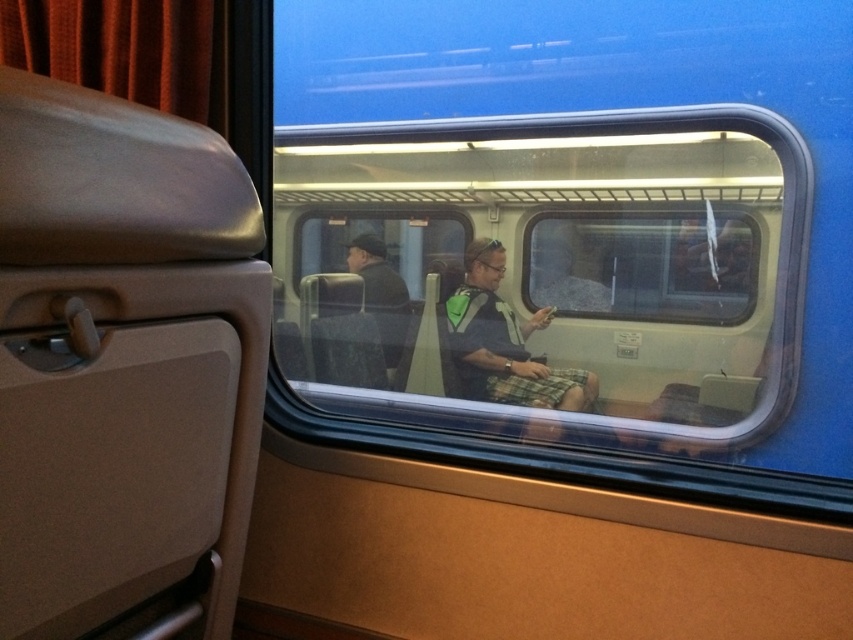
Question: Which point is farther from the camera taking this photo?

Choices:
 (A) (607, 314)
 (B) (584, 400)

Answer: (A)

Question: Which point appears closest to the camera in this image?

Choices:
 (A) (479, 376)
 (B) (349, 230)

Answer: (A)

Question: Is transparent glass train window at center to the right of green fabric backpack at center from the viewer's perspective?

Choices:
 (A) yes
 (B) no

Answer: (B)

Question: In this image, where is transparent glass train window at center located relative to green fabric backpack at center?

Choices:
 (A) above
 (B) below

Answer: (A)

Question: Can you confirm if transparent glass train window at center is bigger than green fabric backpack at center?

Choices:
 (A) yes
 (B) no

Answer: (A)